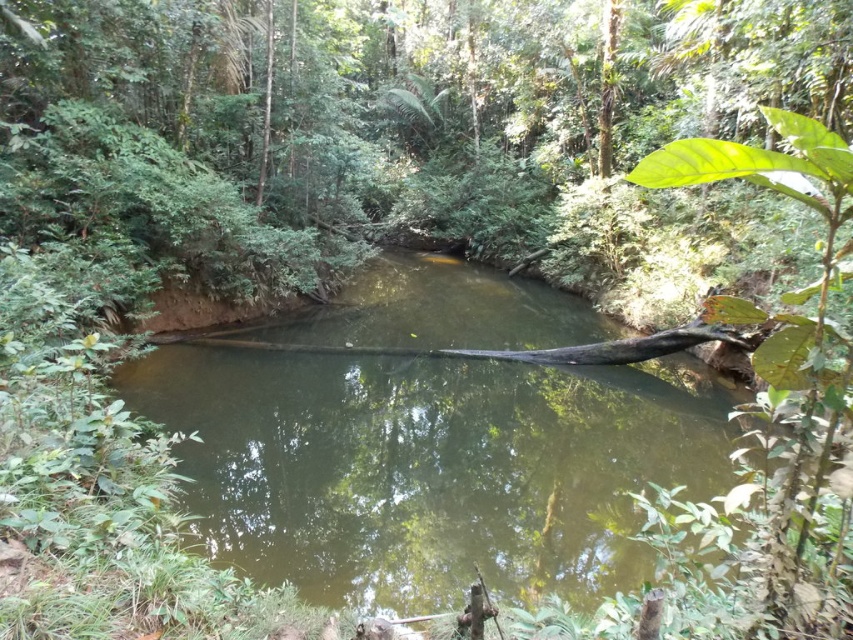
You are standing at the edge of the stream and see two points marked in the scene. Which point, point (405, 493) or point (741, 337), is closer to you?

Point (405, 493) is closer to the viewer than point (741, 337).

You are a kayaker planning to navigate through the green murky water at center and the brown wood log at center. Since the water level is crucial for your journey, which object is higher in elevation?

The green murky water at center has a greater height compared to the brown wood log at center, so the water is higher in elevation than the log.